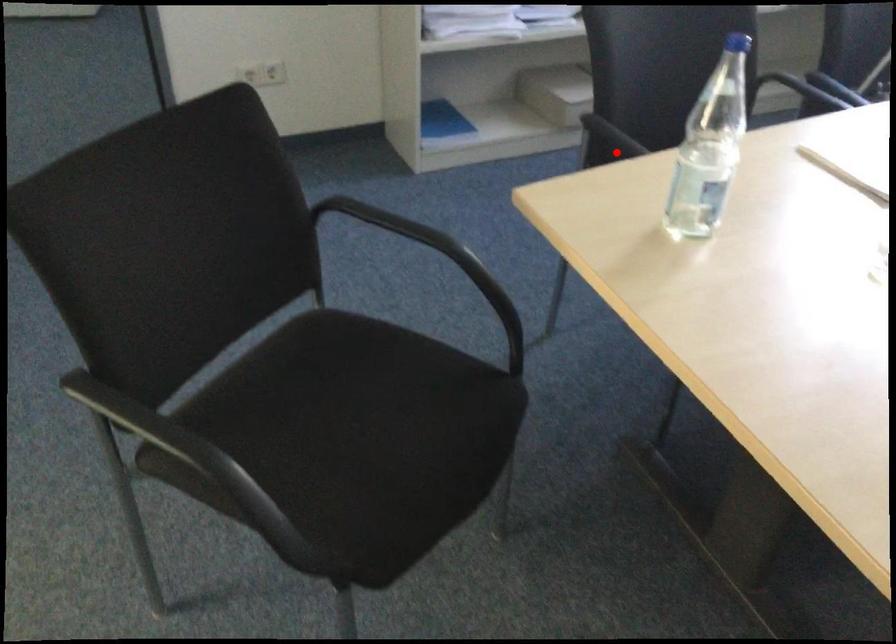
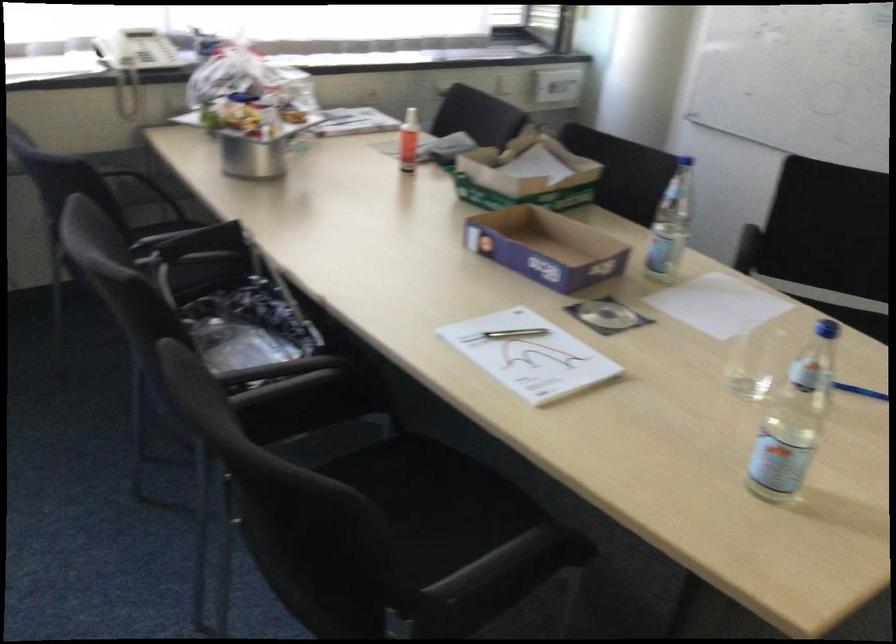
Question: A red point is marked in image1. In image2, is the corresponding 3D point closer to the camera or farther? Reply with the corresponding letter.

Choices:
 (A) The corresponding 3D point is closer.
 (B) The corresponding 3D point is farther.

Answer: (A)